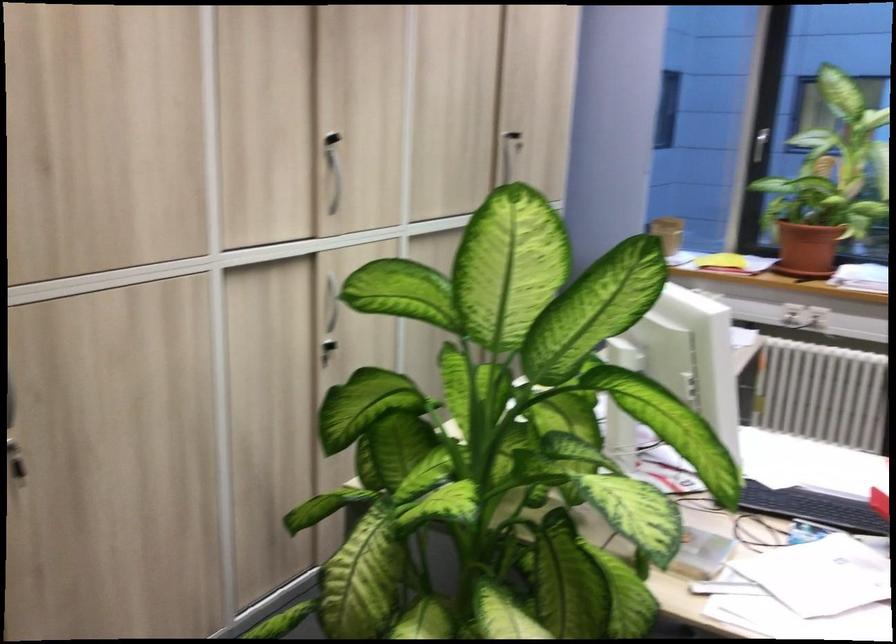
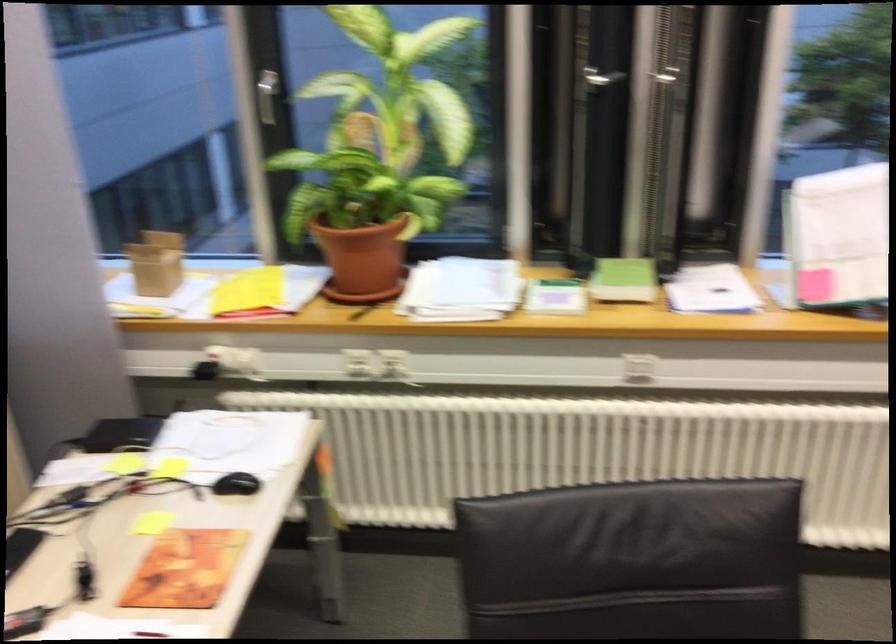
Find the pixel in the second image that matches [753,146] in the first image.

(266, 96)